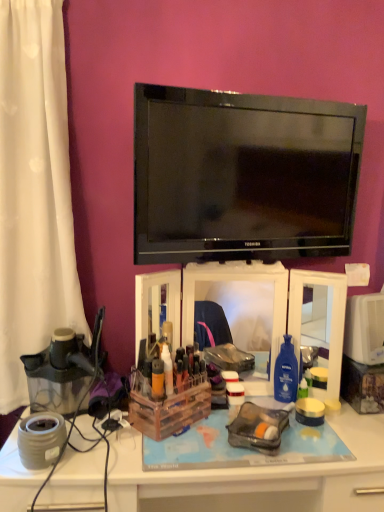
This screenshot has height=512, width=384. Identify the location of empty space that is ontop of wooden/clear plastic storage box at center (from a real-world perspective). (171, 387).